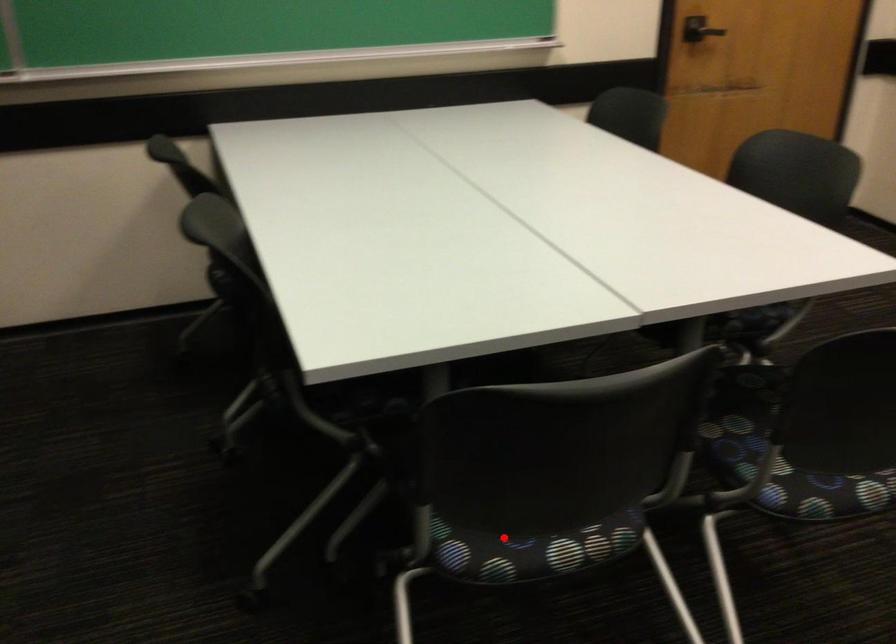
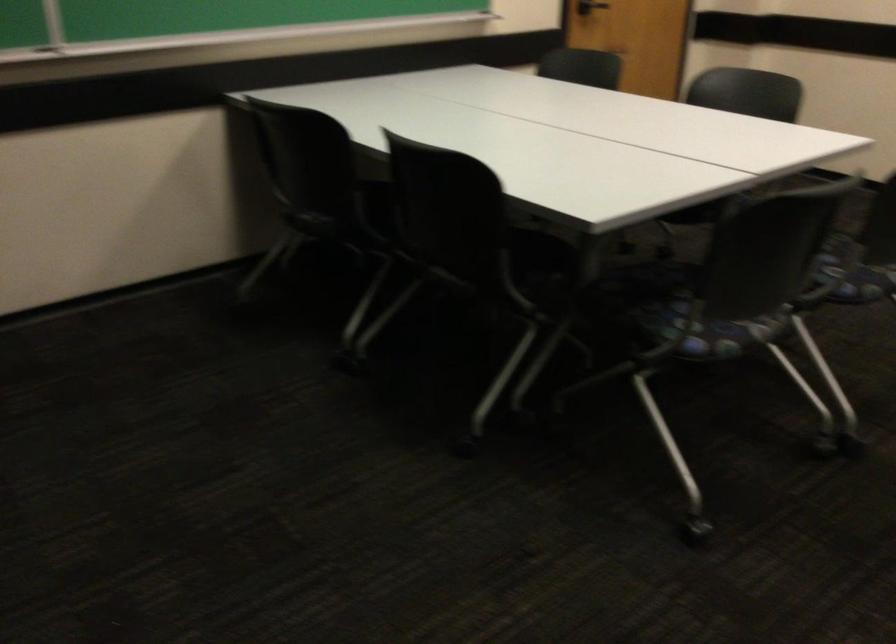
Question: I am providing you with two images of the same scene from different viewpoints. A red point is marked on the first image. At the location where the point appears in image 1, is it still visible in image 2?

Choices:
 (A) Yes
 (B) No

Answer: (A)